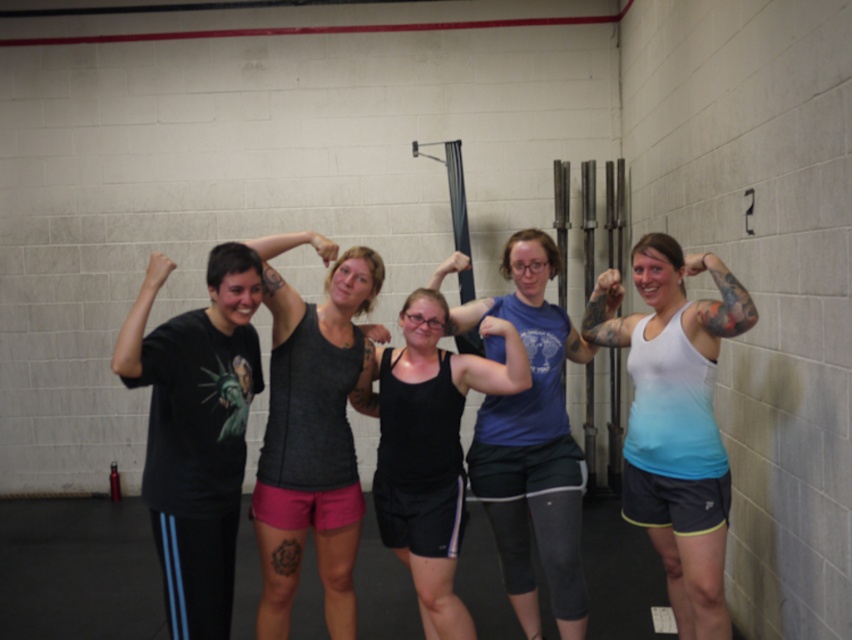
Question: Which of these objects is positioned farthest from the black matte tank top at center?

Choices:
 (A) black matte t-shirt at left
 (B) dark gray tank top at center

Answer: (A)

Question: Which object appears closest to the camera in this image?

Choices:
 (A) black matte t-shirt at left
 (B) black matte tank top at center
 (C) white gradient tank top at right

Answer: (A)

Question: Which object is positioned closest to the black matte t-shirt at left?

Choices:
 (A) dark gray tank top at center
 (B) black matte tank top at center
 (C) white gradient tank top at right

Answer: (A)

Question: Does black matte t-shirt at left lie behind white gradient tank top at right?

Choices:
 (A) yes
 (B) no

Answer: (B)

Question: Does white gradient tank top at right have a lesser width compared to dark gray tank top at center?

Choices:
 (A) no
 (B) yes

Answer: (B)

Question: Observing the image, what is the correct spatial positioning of white gradient tank top at right in reference to dark gray tank top at center?

Choices:
 (A) left
 (B) right

Answer: (B)